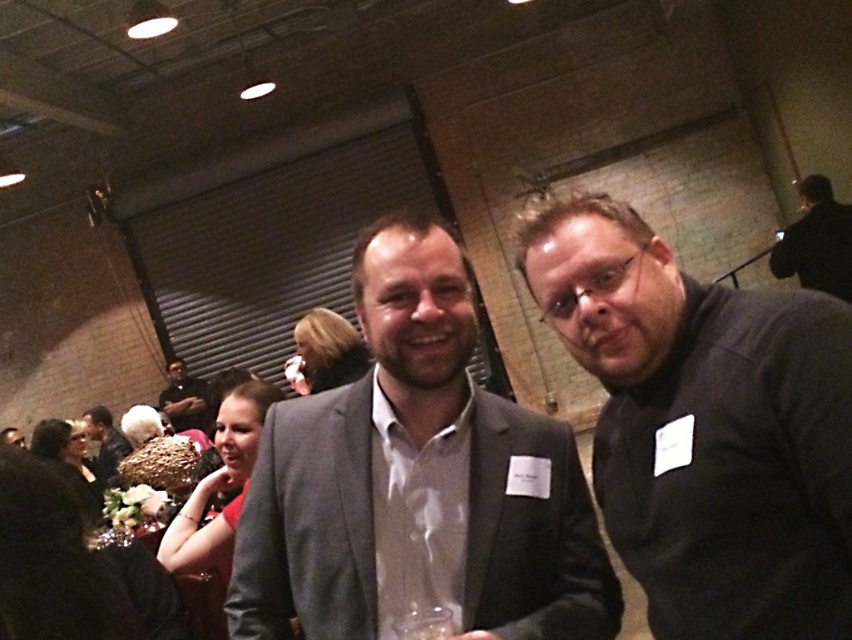
Does point (571, 560) come closer to viewer compared to point (801, 248)?

Yes.

What do you see at coordinates (417, 481) in the screenshot?
I see `matte gray suit at center` at bounding box center [417, 481].

Between point (521, 637) and point (807, 234), which one is positioned in front?

Point (521, 637)

Locate an element on the screen. matte gray suit at center is located at coordinates (417, 481).

Does dark gray sweater at right appear over black matte jacket at upper right?

Incorrect, dark gray sweater at right is not positioned above black matte jacket at upper right.

Measure the distance from dark gray sweater at right to black matte jacket at upper right.

A distance of 13.72 feet exists between dark gray sweater at right and black matte jacket at upper right.

Does point (635, 461) come behind point (797, 253)?

No.

In order to click on dark gray sweater at right in this screenshot , I will do point(705,426).

Looking at this image, can you confirm if dark gray sweater at right is wider than dark gray suit at center?

No, dark gray sweater at right is not wider than dark gray suit at center.

Does dark gray sweater at right have a larger size compared to dark gray suit at center?

Actually, dark gray sweater at right might be smaller than dark gray suit at center.

Where is `dark gray sweater at right`? dark gray sweater at right is located at coordinates (705, 426).